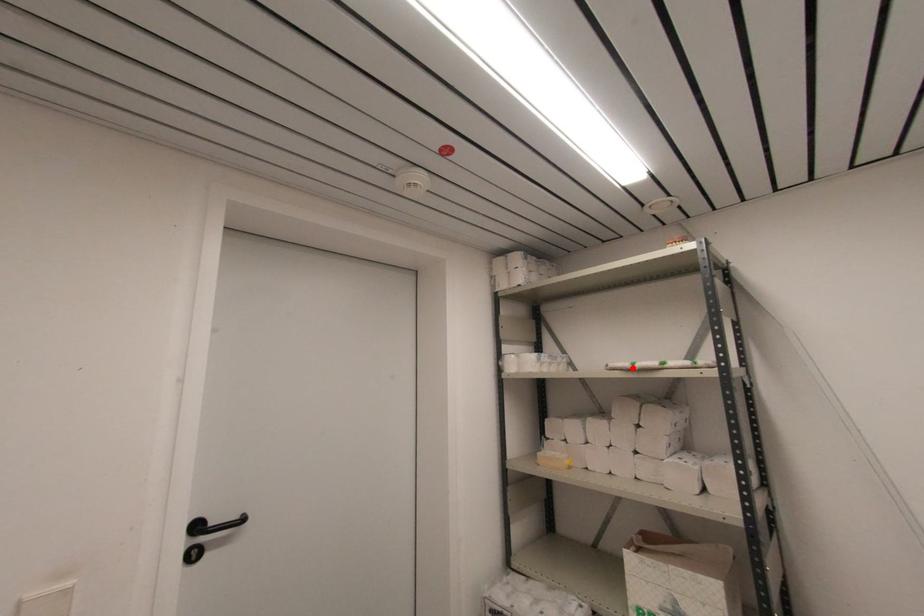
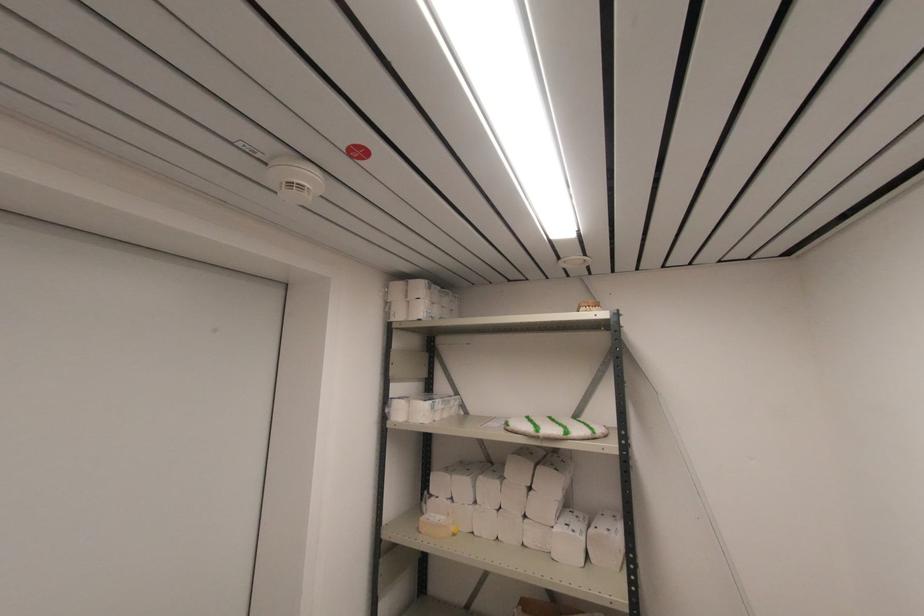
The point at the highlighted location is marked in the first image. Where is the corresponding point in the second image?

(537, 436)